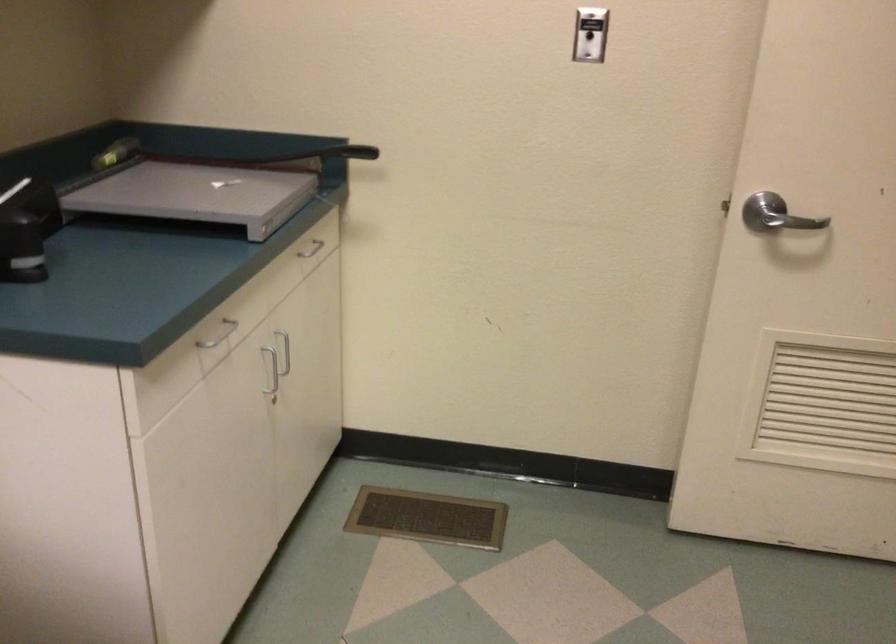
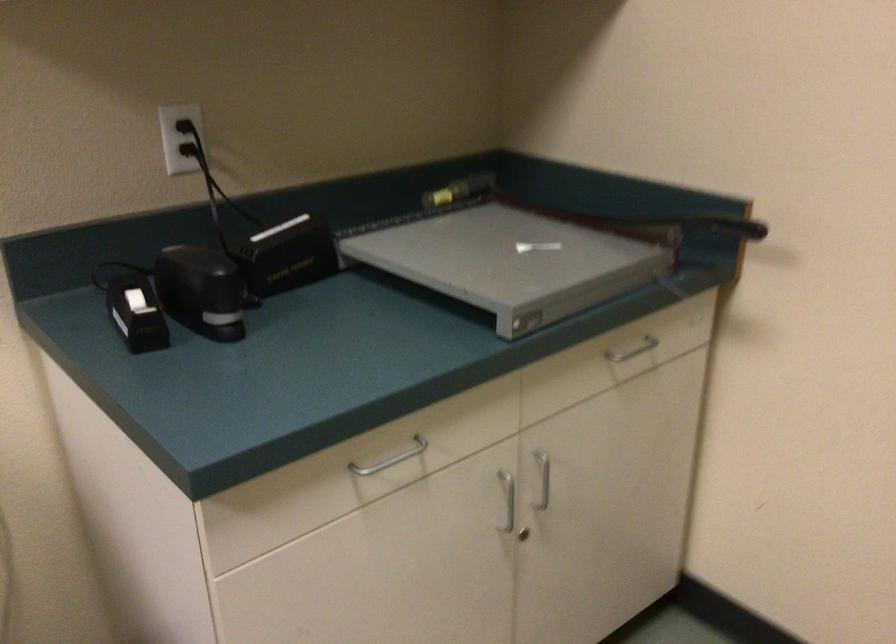
Where in the second image is the point corresponding to point (280, 351) from the first image?

(543, 478)